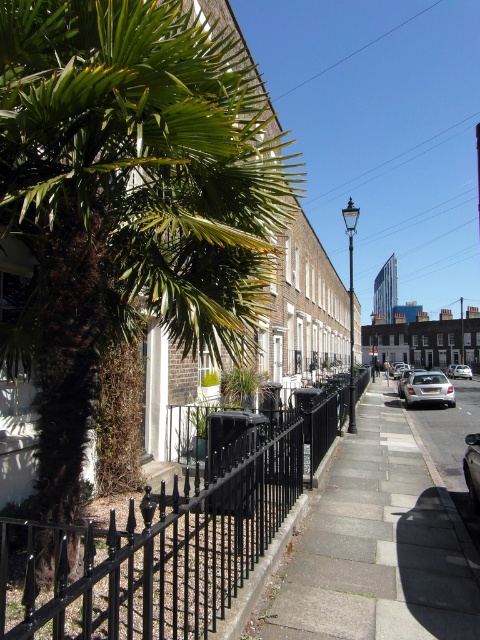
Question: Can you confirm if silver metallic car at center-right is positioned above silver metallic car at center?

Choices:
 (A) no
 (B) yes

Answer: (B)

Question: Which object is farther from the camera taking this photo?

Choices:
 (A) silver metallic car at center
 (B) silver metallic car at center-right
 (C) black wrought iron fence at center

Answer: (A)

Question: Does black wrought iron fence at center have a smaller size compared to silver metallic car at center?

Choices:
 (A) no
 (B) yes

Answer: (B)

Question: Which point appears closest to the camera in this image?

Choices:
 (A) (355, 582)
 (B) (456, 372)
 (C) (172, 577)

Answer: (C)

Question: Is black wrought iron fence at center in front of silver metallic car at center?

Choices:
 (A) no
 (B) yes

Answer: (B)

Question: Which point appears farthest from the camera in this image?

Choices:
 (A) (453, 394)
 (B) (342, 458)
 (C) (240, 260)

Answer: (A)